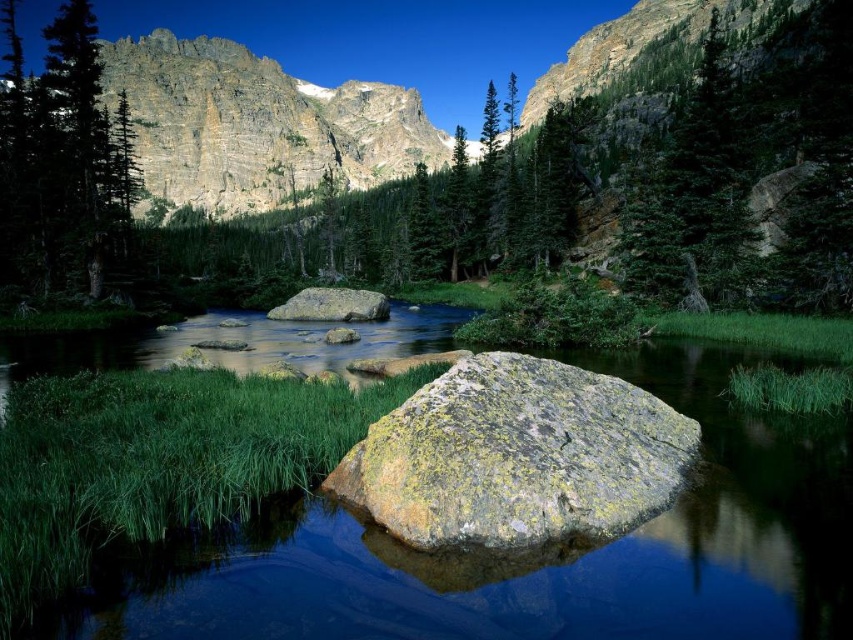
Question: Does rugged stone mountain at upper center have a smaller size compared to green matte tree at left?

Choices:
 (A) no
 (B) yes

Answer: (A)

Question: Is yellow-green mossy rock at center wider than green matte tree at left?

Choices:
 (A) no
 (B) yes

Answer: (A)

Question: Which point is closer to the camera?

Choices:
 (A) (566, 506)
 (B) (161, 65)
 (C) (335, 317)

Answer: (A)

Question: Is rugged stone mountain at upper center positioned in front of gray rough rock at center?

Choices:
 (A) yes
 (B) no

Answer: (B)

Question: Which point appears closest to the camera in this image?

Choices:
 (A) (67, 51)
 (B) (543, 520)
 (C) (227, 52)
 (D) (374, 307)

Answer: (B)

Question: Among these objects, which one is nearest to the camera?

Choices:
 (A) rugged stone mountain at upper center
 (B) green matte tree at left

Answer: (B)